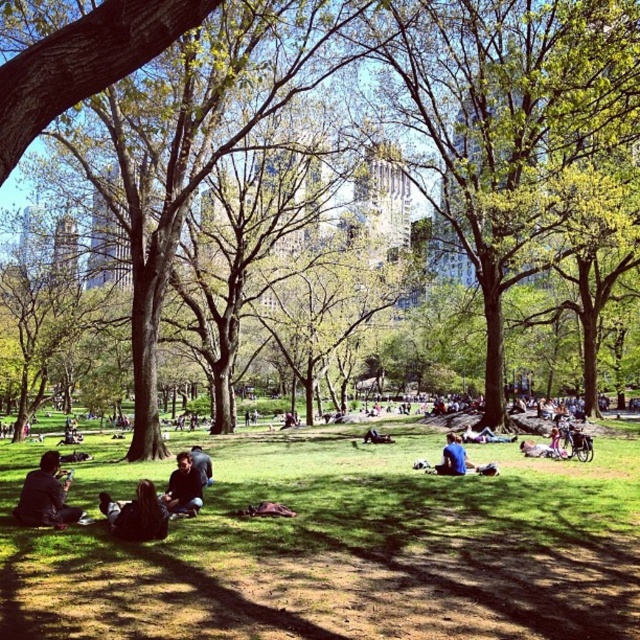
Question: Is dark blue jeans at lower left above dark blue shirt at center?

Choices:
 (A) yes
 (B) no

Answer: (A)

Question: Which object is positioned closest to the green grass at center?

Choices:
 (A) dark blue jeans at lower left
 (B) dark blue jeans at center

Answer: (B)

Question: Is green leafy tree at center bigger than dark brown hair at lower left?

Choices:
 (A) no
 (B) yes

Answer: (B)

Question: Does green grass at center appear under dark blue shirt at center?

Choices:
 (A) yes
 (B) no

Answer: (A)

Question: Which point appears closest to the camera in this image?

Choices:
 (A) (458, 468)
 (B) (484, 243)
 (C) (166, 524)
 (D) (189, 477)

Answer: (C)

Question: Which object is farther from the camera taking this photo?

Choices:
 (A) dark blue jeans at center
 (B) dark blue jeans at lower left

Answer: (A)